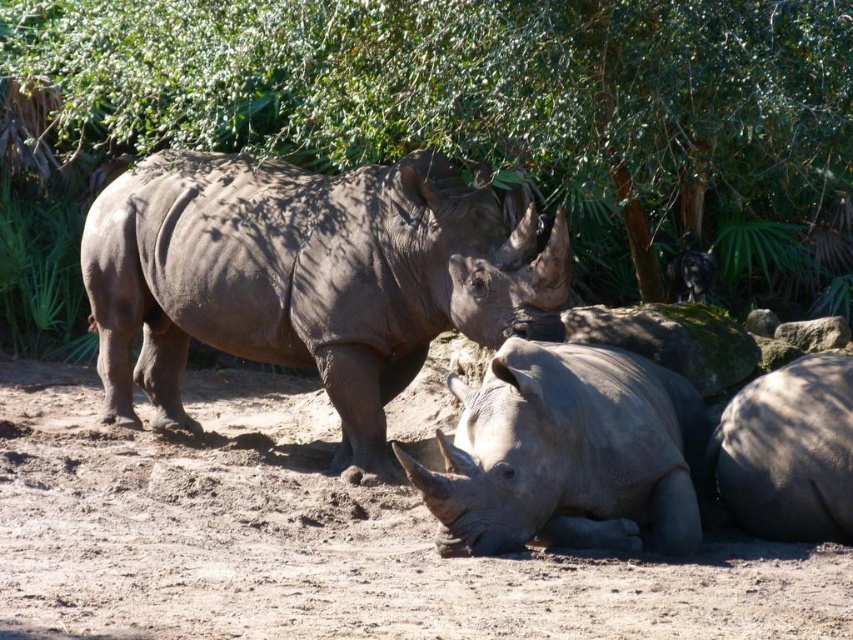
You are standing at the point marked as point (312,509) in the image. The rhinoceroses are located 6.98 meters away from you. The zoo requires that visitors maintain a minimum distance of 6 meters from the animals at all times. Are you in compliance with the safety regulations?

The point (312,509) is 6.98 meters away from the rhinoceroses, which exceeds the required 6 meters minimum distance. Therefore, you are in compliance with the safety regulations.

You are a zookeeper who needs to separate two rhinoceroses. You have a divider that can only fit between them if there is at least 2 meters of space. Can you place the divider between the gray matte rhinoceros at lower center and the gray matte rhinoceros at lower right?

The gray matte rhinoceros at lower center is positioned on the left side of gray matte rhinoceros at lower right, but the distance between them is not specified in the description. Therefore, it is uncertain whether the divider can be placed between them.

You are a zookeeper who needs to place a feeding station for the rhinoceroses. The feeding station must be placed at a location that is not under the green leafy tree at upper center. Where should you place it?

The feeding station should be placed away from the green leafy tree at upper center, which is located at point [479,92]. Choose a spot that is not under this tree to ensure the rhinos have access to their food without obstruction from the tree.